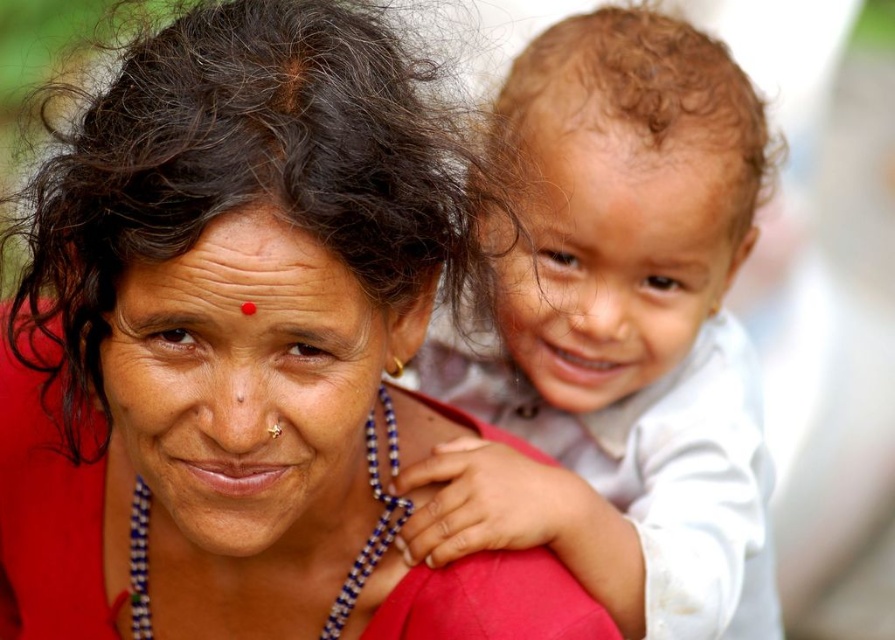
You are a photographer adjusting the camera focus. The smooth white shirt at right and the dark brown curly hair at upper right are both in the frame. Which object should you focus on first if you want to prioritize the taller one?

The smooth white shirt at right is taller than the dark brown curly hair at upper right, so you should focus on the smooth white shirt at right first.

Looking at the scene, where is the dark brown curly hair at upper right in relation to the blue beaded necklace at center?

The dark brown curly hair at upper right is above the blue beaded necklace at center.